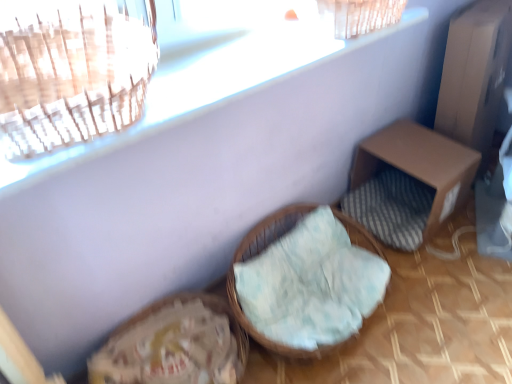
Question: From the image's perspective, is woven wicker basket at center, which is counted as the second furniture, starting from the right, above or below brown cardboard box at right, the second furniture from the left?

Choices:
 (A) above
 (B) below

Answer: (B)

Question: Considering the positions of woven wicker basket at center, which is counted as the second furniture, starting from the right, and brown cardboard box at right, the 1th furniture from the right, in the image, is woven wicker basket at center, which is counted as the second furniture, starting from the right, wider or thinner than brown cardboard box at right, the 1th furniture from the right,?

Choices:
 (A) thin
 (B) wide

Answer: (B)

Question: In terms of height, does woven wicker basket at center, which is counted as the second furniture, starting from the right, look taller or shorter compared to brown cardboard box at right, the second furniture from the left?

Choices:
 (A) short
 (B) tall

Answer: (A)

Question: Is brown cardboard box at right, the second furniture from the left, inside or outside of woven wicker basket at center, which is counted as the second furniture, starting from the right?

Choices:
 (A) outside
 (B) inside

Answer: (A)

Question: From a real-world perspective, is brown cardboard box at right, the 1th furniture from the right, above or below woven wicker basket at center, the 1th furniture in the left-to-right sequence?

Choices:
 (A) below
 (B) above

Answer: (B)

Question: Considering the positions of brown cardboard box at right, the second furniture from the left, and woven wicker basket at center, the 1th furniture in the left-to-right sequence, in the image, is brown cardboard box at right, the second furniture from the left, taller or shorter than woven wicker basket at center, the 1th furniture in the left-to-right sequence,?

Choices:
 (A) short
 (B) tall

Answer: (B)

Question: Looking at the image, does brown cardboard box at right, the second furniture from the left, seem bigger or smaller compared to woven wicker basket at center, which is counted as the second furniture, starting from the right?

Choices:
 (A) small
 (B) big

Answer: (B)